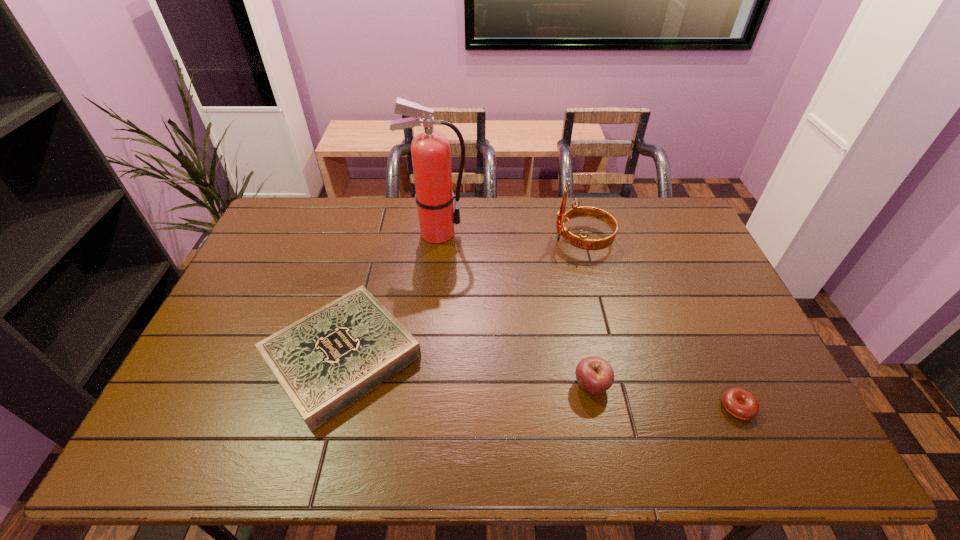
Where is `free spot between the fourth tallest object and the tallest object`? free spot between the fourth tallest object and the tallest object is located at coordinates (389, 295).

Locate an element on the screen. The width and height of the screenshot is (960, 540). empty space between the tiara and the fire extinguisher is located at coordinates (510, 237).

The width and height of the screenshot is (960, 540). I want to click on free space between the rightmost object and the third tallest object, so click(x=664, y=396).

The image size is (960, 540). Identify the location of vacant space that is in between the hardback book and the fire extinguisher. (389, 295).

This screenshot has width=960, height=540. Identify the location of vacant area between the apple and the rightmost object. (664, 396).

Locate which object ranks third in proximity to the second shortest object. Please provide its 2D coordinates. Your answer should be formatted as a tuple, i.e. [(x, y)], where the tuple contains the x and y coordinates of a point satisfying the conditions above.

[(580, 242)]

Locate an element on the screen. Image resolution: width=960 pixels, height=540 pixels. object that stands as the closest to the tiara is located at coordinates (431, 156).

At what (x,y) coordinates should I click in order to perform the action: click on vacant area in the image that satisfies the following two spatial constraints: 1. on the back side of the doughnut; 2. on the side of the third tallest object with the unique marking. Please return your answer as a coordinate pair (x, y). This screenshot has height=540, width=960. Looking at the image, I should click on (728, 385).

This screenshot has width=960, height=540. What are the coordinates of `free location that satisfies the following two spatial constraints: 1. on the front-facing side of the rightmost object; 2. on the left side of the tiara` in the screenshot? It's located at (625, 407).

This screenshot has width=960, height=540. I want to click on vacant space that satisfies the following two spatial constraints: 1. on the back side of the shortest object; 2. on the front-facing side of the fourth shortest object, so click(662, 240).